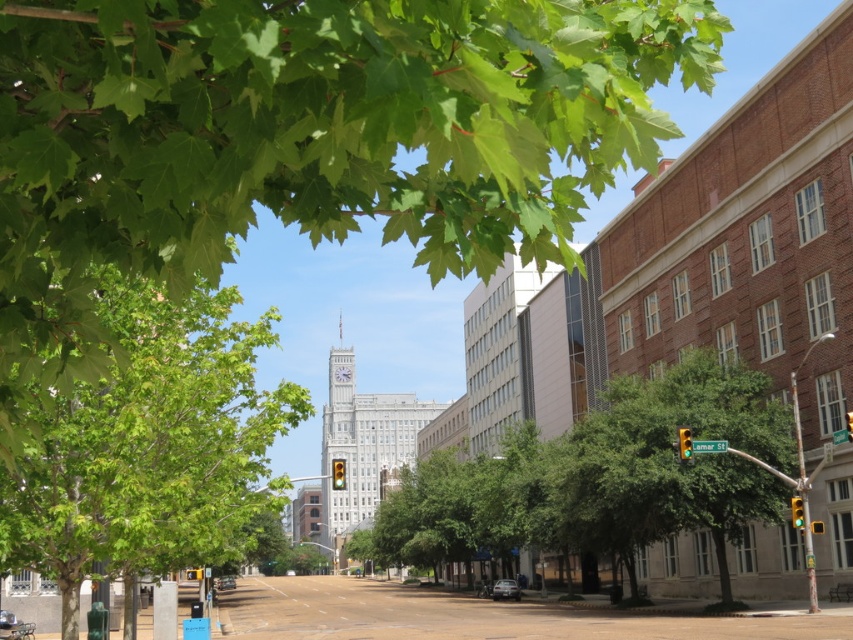
Question: Is green leafy tree at upper left bigger than green leafy tree at left?

Choices:
 (A) yes
 (B) no

Answer: (B)

Question: Estimate the real-world distances between objects in this image. Which object is farther from the green leafy tree at center?

Choices:
 (A) green leafy tree at upper left
 (B) green leafy tree at left

Answer: (A)

Question: Which point is farther to the camera?

Choices:
 (A) (459, 81)
 (B) (234, 401)
 (C) (408, 516)

Answer: (C)

Question: Among these points, which one is nearest to the camera?

Choices:
 (A) (532, 508)
 (B) (157, 177)
 (C) (164, 339)

Answer: (B)

Question: Is green leafy tree at left to the right of green leafy tree at center from the viewer's perspective?

Choices:
 (A) no
 (B) yes

Answer: (A)

Question: Is green leafy tree at upper left closer to camera compared to green leafy tree at center?

Choices:
 (A) no
 (B) yes

Answer: (B)